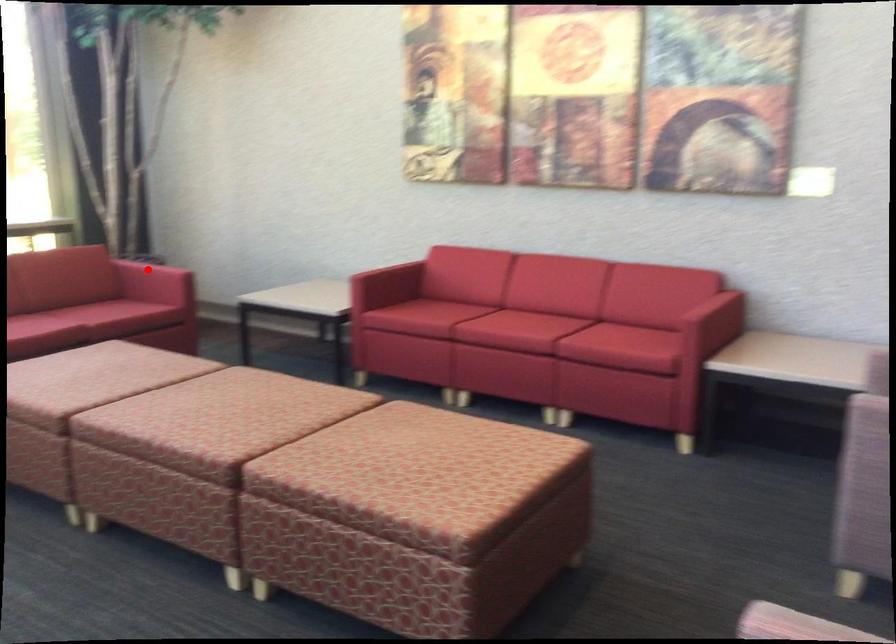
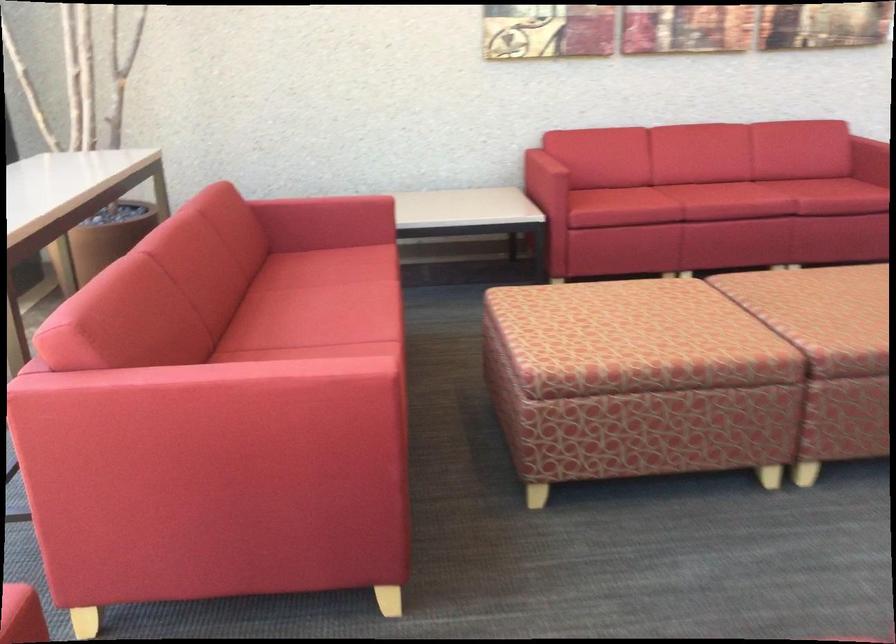
Question: I am providing you with two images of the same scene from different viewpoints. A red point is shown in image1. For the corresponding object point in image2, is it positioned nearer or farther from the camera?

Choices:
 (A) Nearer
 (B) Farther

Answer: (A)